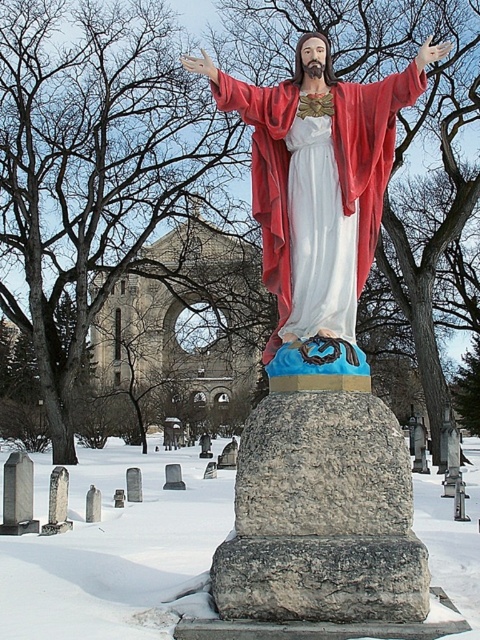
You are an artist planning to sketch this winter scene. You want to ensure the proportions between the gray stone gravestone at center and the velvet red robe at center are accurate. Which object should you draw first to maintain proper scale, considering their sizes?

The gray stone gravestone at center has a larger width than the velvet red robe at center, so you should draw the gray stone gravestone at center first to establish the correct scale before adding the smaller velvet red robe at center.

You are a visitor at the statue and want to place a flower bouquet on the gray stone gravestone at center. However, you notice the velvet red robe at center is in the way. Can you place the bouquet directly under the robe without moving it?

The gray stone gravestone at center is positioned under the velvet red robe at center, so placing the bouquet directly under the robe would mean placing it on the gravestone itself. Since the gravestone is already under the robe, you can place the bouquet there without moving the robe.

You are an artist planning to sketch this winter scene. You want to ensure the gray stone gravestone at center and the white snow at center are proportionally accurate. Which object should you draw larger in your sketch?

The white snow at center should be drawn larger than the gray stone gravestone at center because the gray stone gravestone at center occupies less space than white snow at center.